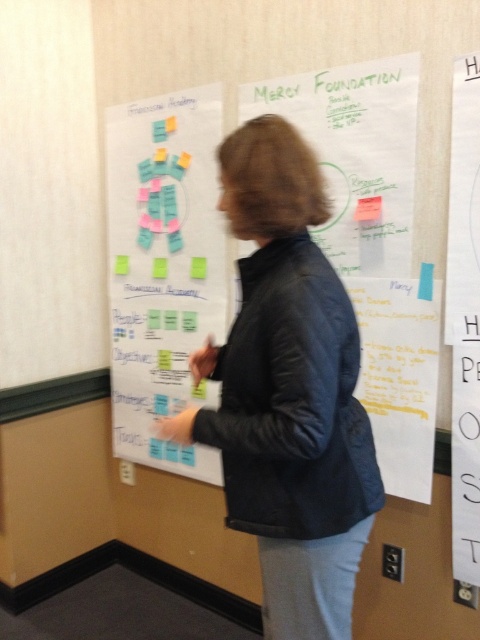
Question: Is dark blue leather jacket at center further to camera compared to teal matte sticky notes at center?

Choices:
 (A) no
 (B) yes

Answer: (A)

Question: Which point is farther from the camera taking this photo?

Choices:
 (A) (232, 353)
 (B) (455, 572)
 (C) (172, 93)

Answer: (C)

Question: Can you confirm if dark blue leather jacket at center is smaller than teal matte sticky notes at center?

Choices:
 (A) no
 (B) yes

Answer: (B)

Question: Which point is closer to the camera taking this photo?

Choices:
 (A) (458, 284)
 (B) (135, 333)
 (C) (241, 371)

Answer: (C)

Question: Does dark blue leather jacket at center come behind teal matte sticky notes at center?

Choices:
 (A) yes
 (B) no

Answer: (B)

Question: Which point is closer to the camera?

Choices:
 (A) (479, 394)
 (B) (177, 321)

Answer: (A)